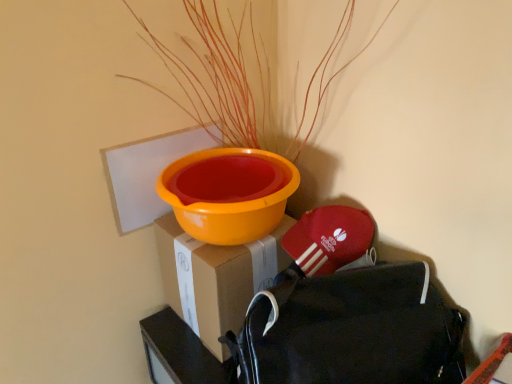
What do you see at coordinates (239, 126) in the screenshot?
I see `orange matte plant at upper center` at bounding box center [239, 126].

The height and width of the screenshot is (384, 512). What are the coordinates of `black fabric backpack at lower right` in the screenshot? It's located at (350, 331).

Locate an element on the screen. This screenshot has width=512, height=384. cardboard box at center is located at coordinates (216, 278).

Find the location of `orange matte plant at upper center`. orange matte plant at upper center is located at coordinates (239, 126).

Which object is wider, black fabric backpack at lower right or orange matte plant at upper center?

orange matte plant at upper center.

From a real-world perspective, is black fabric backpack at lower right located higher than orange matte plant at upper center?

No, from a real-world perspective, black fabric backpack at lower right is not on top of orange matte plant at upper center.

Is orange matte plant at upper center completely or partially inside black fabric backpack at lower right?

No.

The image size is (512, 384). What are the coordinates of `houseplant on the left of black fabric backpack at lower right` in the screenshot? It's located at (239, 126).

Would you say cardboard box at center is part of orange matte plant at upper center's contents?

No, cardboard box at center is not inside orange matte plant at upper center.

Locate an element on the screen. Image resolution: width=512 pixels, height=384 pixels. cardboard box that appears behind the orange matte plant at upper center is located at coordinates (216, 278).

From a real-world perspective, which is physically above, orange matte plant at upper center or cardboard box at center?

orange matte plant at upper center, from a real-world perspective.

Can you confirm if orange matte plant at upper center is wider than cardboard box at center?

Indeed, orange matte plant at upper center has a greater width compared to cardboard box at center.

Visually, is black fabric backpack at lower right positioned to the left or to the right of cardboard box at center?

Clearly, black fabric backpack at lower right is on the right of cardboard box at center in the image.

How many degrees apart are the facing directions of black fabric backpack at lower right and cardboard box at center?

There is a 65.3-degree angle between the facing directions of black fabric backpack at lower right and cardboard box at center.

From their relative heights in the image, would you say black fabric backpack at lower right is taller or shorter than cardboard box at center?

In the image, black fabric backpack at lower right appears to be taller than cardboard box at center.

Identify the location of cardboard box above the black fabric backpack at lower right (from the image's perspective). The height and width of the screenshot is (384, 512). (216, 278).

Are orange matte plant at upper center and black fabric backpack at lower right far apart?

No, there isn't a large distance between orange matte plant at upper center and black fabric backpack at lower right.

Is point (149, 36) less distant than point (264, 350)?

No, (149, 36) is further to viewer.

In order to click on backpack that is in front of the orange matte plant at upper center in this screenshot , I will do `click(350, 331)`.

Considering the sizes of orange matte plant at upper center and black fabric backpack at lower right in the image, is orange matte plant at upper center taller or shorter than black fabric backpack at lower right?

In the image, orange matte plant at upper center appears to be taller than black fabric backpack at lower right.

In the image, there is a orange matte plant at upper center. Where is `cardboard box below it (from a real-world perspective)`? The width and height of the screenshot is (512, 384). cardboard box below it (from a real-world perspective) is located at coordinates (216, 278).

From a real-world perspective, which object stands above the other?

From a 3D spatial view, orange matte plant at upper center is above.

Considering the relative positions of cardboard box at center and orange matte plant at upper center in the image provided, is cardboard box at center behind orange matte plant at upper center?

Yes, cardboard box at center is further from the camera.

Does point (208, 291) come closer to viewer compared to point (246, 349)?

That is False.

From the image's perspective, which one is positioned higher, cardboard box at center or black fabric backpack at lower right?

cardboard box at center appears higher in the image.

How many degrees apart are the facing directions of cardboard box at center and black fabric backpack at lower right?

The facing directions of cardboard box at center and black fabric backpack at lower right are 65.3 degrees apart.

The image size is (512, 384). What are the coordinates of `cardboard box below the black fabric backpack at lower right (from a real-world perspective)` in the screenshot? It's located at (216, 278).

Find the location of a particular element. This screenshot has height=384, width=512. backpack below the orange matte plant at upper center (from the image's perspective) is located at coordinates (350, 331).

The height and width of the screenshot is (384, 512). What are the coordinates of `houseplant that appears in front of the cardboard box at center` in the screenshot? It's located at (239, 126).

Estimate the real-world distances between objects in this image. Which object is further from black fabric backpack at lower right, cardboard box at center or orange matte plant at upper center?

orange matte plant at upper center.

Considering their positions, is orange matte plant at upper center positioned further to black fabric backpack at lower right than cardboard box at center?

The object further to black fabric backpack at lower right is orange matte plant at upper center.

Which object lies further to the anchor point orange matte plant at upper center, black fabric backpack at lower right or cardboard box at center?

The object further to orange matte plant at upper center is black fabric backpack at lower right.

Looking at the image, which one is located closer to orange matte plant at upper center, cardboard box at center or black fabric backpack at lower right?

cardboard box at center lies closer to orange matte plant at upper center than the other object.

Estimate the real-world distances between objects in this image. Which object is further from cardboard box at center, black fabric backpack at lower right or orange matte plant at upper center?

Among the two, orange matte plant at upper center is located further to cardboard box at center.

Looking at the image, which one is located further to cardboard box at center, orange matte plant at upper center or black fabric backpack at lower right?

orange matte plant at upper center is positioned further to the anchor cardboard box at center.

Where is `cardboard box between orange matte plant at upper center and black fabric backpack at lower right from top to bottom`? This screenshot has width=512, height=384. cardboard box between orange matte plant at upper center and black fabric backpack at lower right from top to bottom is located at coordinates (216, 278).